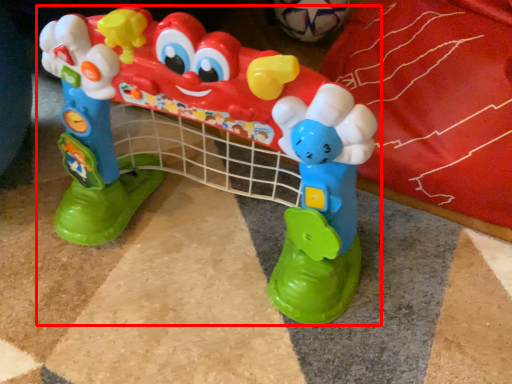
Question: From the image's perspective, where is toy (annotated by the red box) located in relation to toy in the image?

Choices:
 (A) below
 (B) above

Answer: (A)